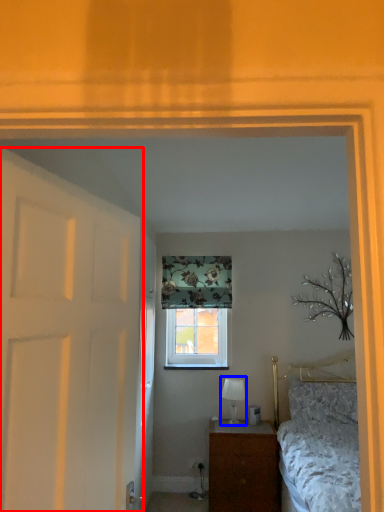
Question: Which of the following is the closest to the observer, door (highlighted by a red box) or table lamp (highlighted by a blue box)?

Choices:
 (A) door
 (B) table lamp

Answer: (A)